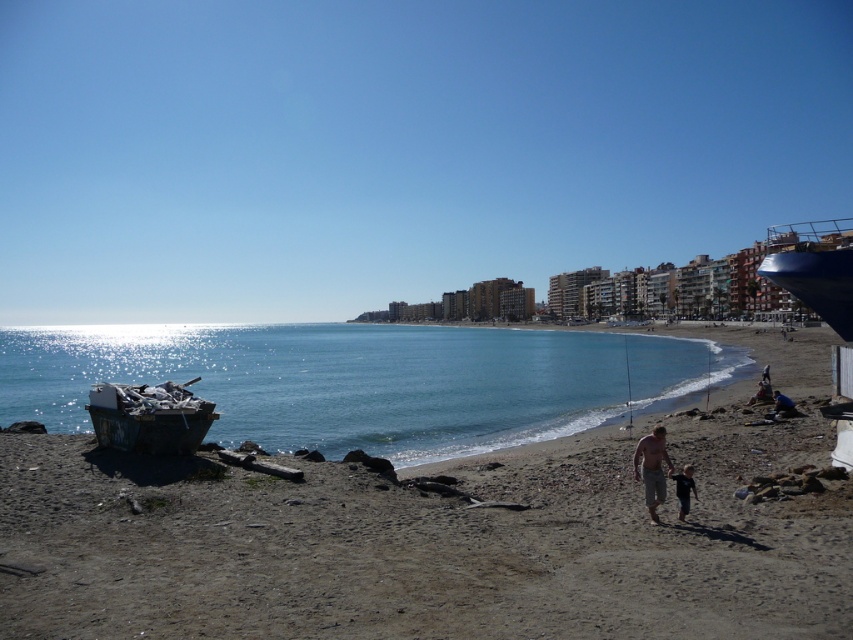
You are a swimmer wanting to cross from the rusty metal boat at left to the blue glossy water at center. Can you swim directly across without needing to go around the boat?

The blue glossy water at center might be wider than rusty metal boat at left, so it is possible that there is enough space to swim directly across without needing to go around the boat. However, the exact width isn